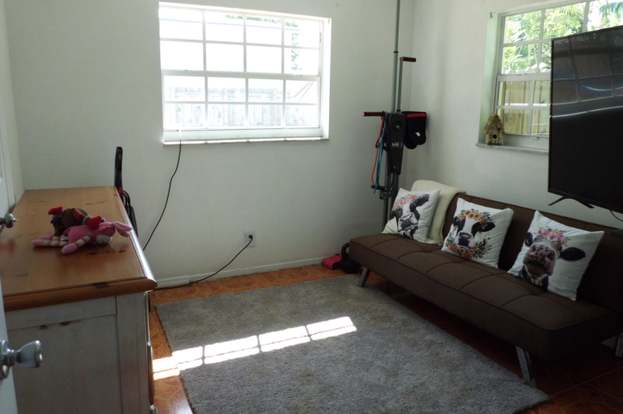
This screenshot has height=414, width=623. Find the location of `vertical climber exercise machine`. vertical climber exercise machine is located at coordinates (397, 129).